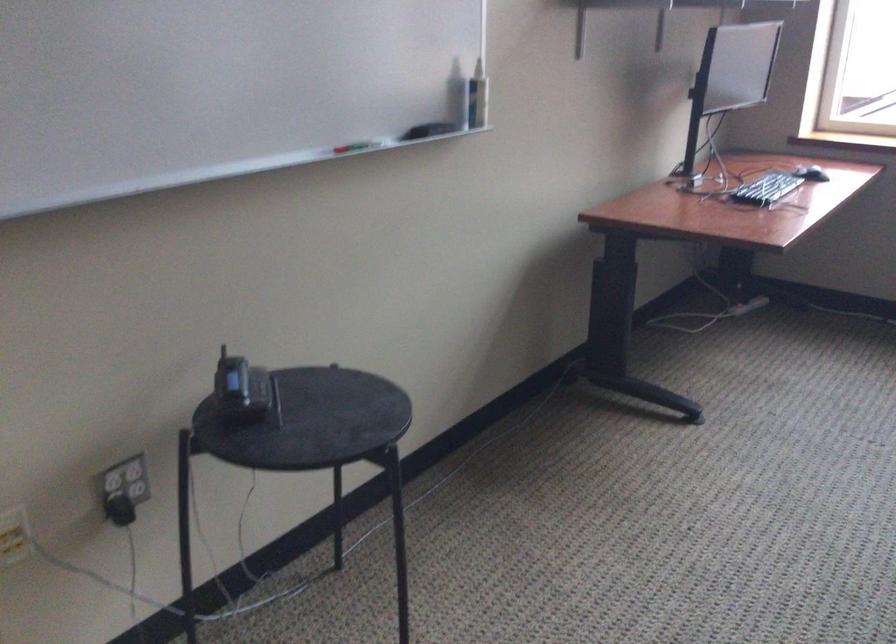
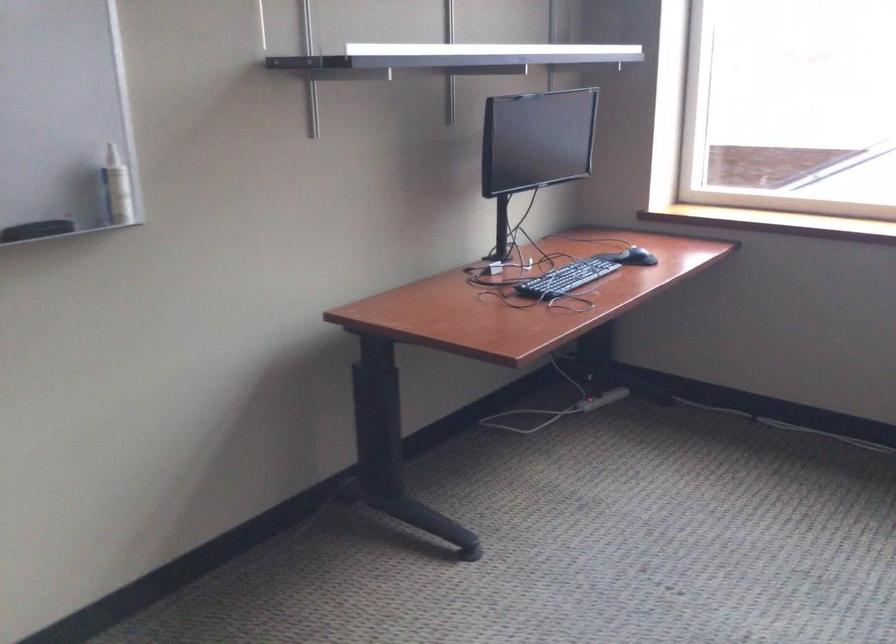
Locate, in the second image, the point that corresponds to point (426, 134) in the first image.

(36, 230)